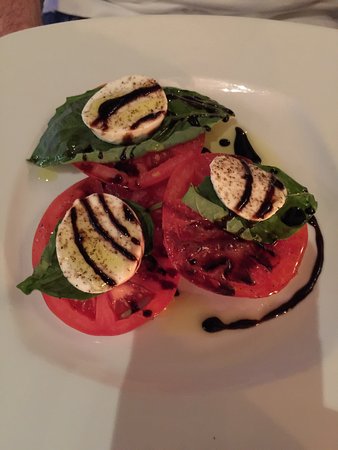
The width and height of the screenshot is (338, 450). Find the location of `plate`. plate is located at coordinates (304, 135).